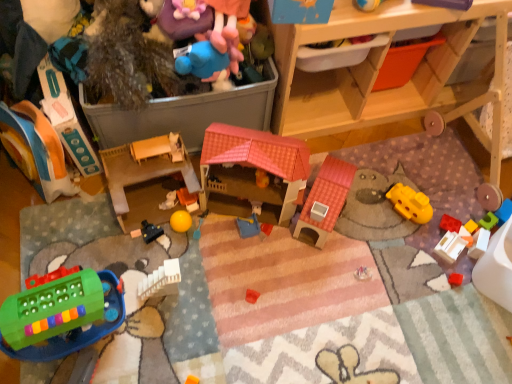
The image size is (512, 384). What are the coordinates of `vacant region to the left of smooth orange ball at center, which is the seventh toy in right-to-left order` in the screenshot? It's located at (134, 209).